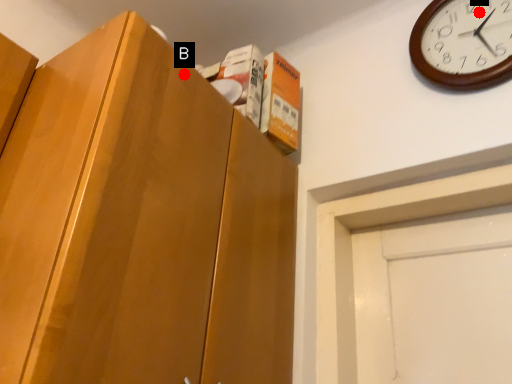
Question: Two points are circled on the image, labeled by A and B beside each circle. Which point is farther to the camera?

Choices:
 (A) A is further
 (B) B is further

Answer: (A)